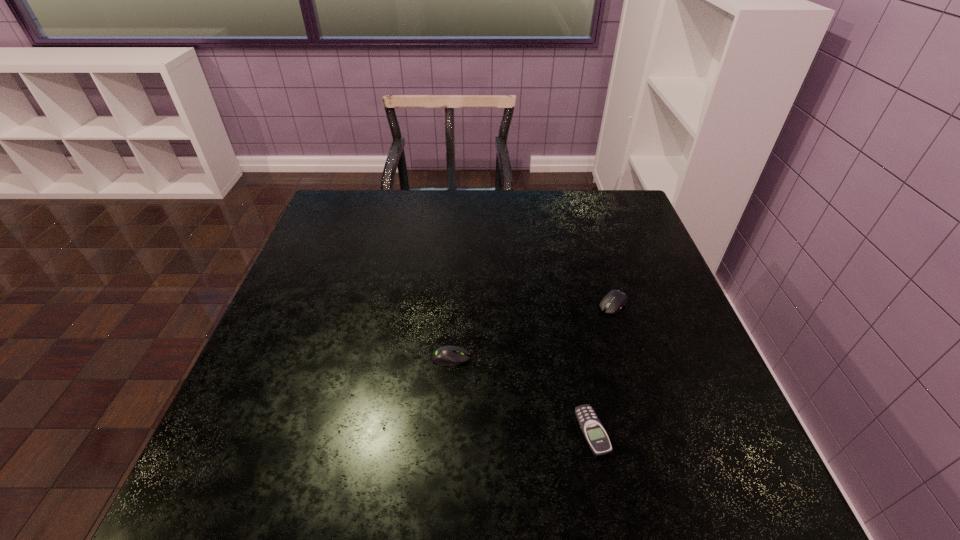
Find the location of a particular element. This screenshot has width=960, height=540. vacant position in the image that satisfies the following two spatial constraints: 1. on the back side of the nearest object; 2. on the right side of the right computer mouse is located at coordinates (566, 304).

This screenshot has width=960, height=540. Find the location of `free space that satisfies the following two spatial constraints: 1. on the front side of the right computer mouse; 2. on the wheel side of the left computer mouse`. free space that satisfies the following two spatial constraints: 1. on the front side of the right computer mouse; 2. on the wheel side of the left computer mouse is located at coordinates (630, 358).

At what (x,y) coordinates should I click in order to perform the action: click on vacant space that satisfies the following two spatial constraints: 1. on the wheel side of the second object from left to right; 2. on the left side of the second nearest object. Please return your answer as a coordinate pair (x, y). Looking at the image, I should click on (446, 431).

Where is `vacant region that satisfies the following two spatial constraints: 1. on the back side of the second object from left to right; 2. on the wheel side of the second nearest object`? The width and height of the screenshot is (960, 540). vacant region that satisfies the following two spatial constraints: 1. on the back side of the second object from left to right; 2. on the wheel side of the second nearest object is located at coordinates (577, 358).

Locate an element on the screen. This screenshot has width=960, height=540. vacant space that satisfies the following two spatial constraints: 1. on the front side of the rightmost object; 2. on the wheel side of the second farthest object is located at coordinates (630, 358).

At what (x,y) coordinates should I click in order to perform the action: click on free region that satisfies the following two spatial constraints: 1. on the back side of the farthest object; 2. on the left side of the nearest object. Please return your answer as a coordinate pair (x, y). Looking at the image, I should click on (566, 304).

Identify the location of vacant area in the image that satisfies the following two spatial constraints: 1. on the wheel side of the nearer computer mouse; 2. on the left side of the nearest object. (446, 431).

Image resolution: width=960 pixels, height=540 pixels. I want to click on free space in the image that satisfies the following two spatial constraints: 1. on the front side of the farther computer mouse; 2. on the wheel side of the left computer mouse, so click(x=630, y=358).

I want to click on free space that satisfies the following two spatial constraints: 1. on the wheel side of the second nearest object; 2. on the back side of the beeper, so click(x=446, y=431).

Where is `vacant point that satisfies the following two spatial constraints: 1. on the wheel side of the leftmost object; 2. on the right side of the shortest object`? Image resolution: width=960 pixels, height=540 pixels. vacant point that satisfies the following two spatial constraints: 1. on the wheel side of the leftmost object; 2. on the right side of the shortest object is located at coordinates tap(446, 431).